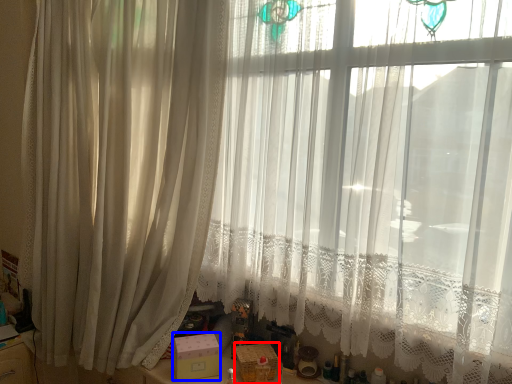
Question: Which object is further to the camera taking this photo, box (highlighted by a red box) or box (highlighted by a blue box)?

Choices:
 (A) box
 (B) box

Answer: (B)